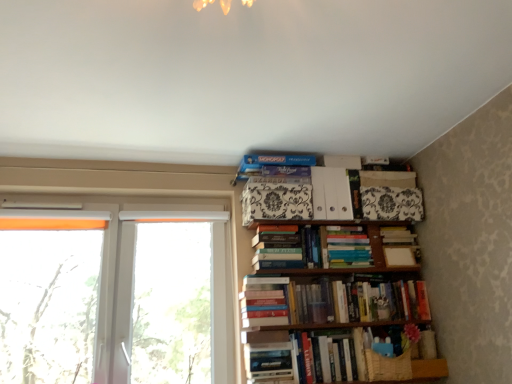
Question: Does transparent plastic window at left, the 3th window positioned from the left, have a lesser width compared to blue cardboard game at upper center, acting as the first book starting from the top?

Choices:
 (A) no
 (B) yes

Answer: (B)

Question: Could you tell me if transparent plastic window at left, the 3th window positioned from the left, is facing blue cardboard game at upper center, acting as the first book starting from the top?

Choices:
 (A) yes
 (B) no

Answer: (B)

Question: Is transparent plastic window at left, arranged as the 1th window when viewed from the right, turned away from blue cardboard game at upper center, acting as the first book starting from the top?

Choices:
 (A) yes
 (B) no

Answer: (B)

Question: Considering the relative positions of transparent plastic window at left, arranged as the 1th window when viewed from the right, and blue cardboard game at upper center, which appears as the 9th book when ordered from the bottom, in the image provided, is transparent plastic window at left, arranged as the 1th window when viewed from the right, to the right of blue cardboard game at upper center, which appears as the 9th book when ordered from the bottom, from the viewer's perspective?

Choices:
 (A) yes
 (B) no

Answer: (B)

Question: Can you confirm if transparent plastic window at left, the 3th window positioned from the left, is positioned to the left of blue cardboard game at upper center, which appears as the 9th book when ordered from the bottom?

Choices:
 (A) yes
 (B) no

Answer: (A)

Question: Looking at their shapes, would you say hardcover books at center, the 2th book viewed from the top, is wider or thinner than white paper at center, which appears as the fourth book when viewed from the top?

Choices:
 (A) thin
 (B) wide

Answer: (A)

Question: Considering the positions of hardcover books at center, marked as the eighth book in a bottom-to-top arrangement, and white paper at center, which is counted as the 6th book, starting from the bottom, in the image, is hardcover books at center, marked as the eighth book in a bottom-to-top arrangement, bigger or smaller than white paper at center, which is counted as the 6th book, starting from the bottom,?

Choices:
 (A) big
 (B) small

Answer: (A)

Question: Would you say hardcover books at center, marked as the eighth book in a bottom-to-top arrangement, is to the left or to the right of white paper at center, which is counted as the 6th book, starting from the bottom, in the picture?

Choices:
 (A) right
 (B) left

Answer: (B)

Question: Is point (364, 235) closer or farther from the camera than point (386, 235)?

Choices:
 (A) farther
 (B) closer

Answer: (B)

Question: Considering the positions of hardcover books at center, which is the fourth book in bottom-to-top order, and white plastic window at left, arranged as the 2th window when viewed from the left, in the image, is hardcover books at center, which is the fourth book in bottom-to-top order, bigger or smaller than white plastic window at left, arranged as the 2th window when viewed from the left,?

Choices:
 (A) small
 (B) big

Answer: (A)

Question: Is point (418, 304) positioned closer to the camera than point (87, 301)?

Choices:
 (A) closer
 (B) farther

Answer: (B)

Question: Do you think hardcover books at center, the sixth book viewed from the top, is within white plastic window at left, acting as the 2th window starting from the right, or outside of it?

Choices:
 (A) inside
 (B) outside

Answer: (B)

Question: Considering their positions, is hardcover books at center, which is the fourth book in bottom-to-top order, located in front of or behind white plastic window at left, arranged as the 2th window when viewed from the left?

Choices:
 (A) behind
 (B) front

Answer: (A)

Question: Does point (320, 215) appear closer or farther from the camera than point (313, 375)?

Choices:
 (A) farther
 (B) closer

Answer: (A)

Question: Is white matte folder at upper center, which is counted as the second paperback book, starting from the left, wider or thinner than hardcover book at lower right, the seventh book positioned from the top?

Choices:
 (A) thin
 (B) wide

Answer: (B)